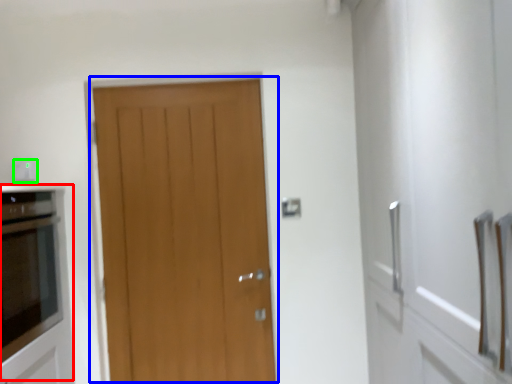
Question: Based on their relative distances, which object is farther from appliance (highlighted by a red box)? Choose from door (highlighted by a blue box) and electric outlet (highlighted by a green box).

Choices:
 (A) door
 (B) electric outlet

Answer: (B)